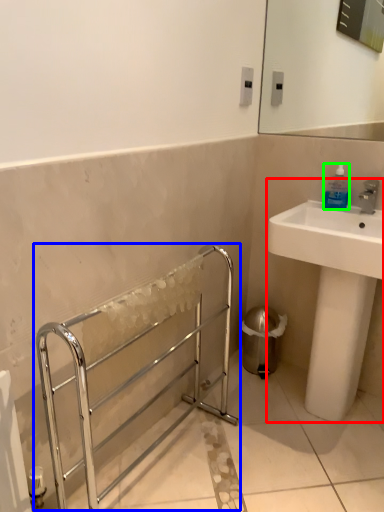
Question: Estimate the real-world distances between objects in this image. Which object is closer to sink (highlighted by a red box), balustrade (highlighted by a blue box) or bottle (highlighted by a green box)?

Choices:
 (A) balustrade
 (B) bottle

Answer: (B)